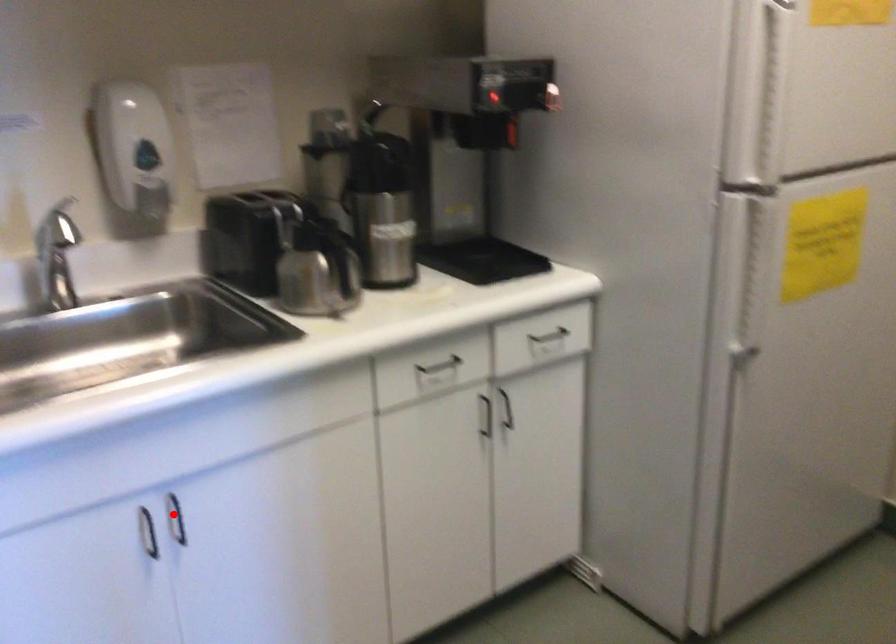
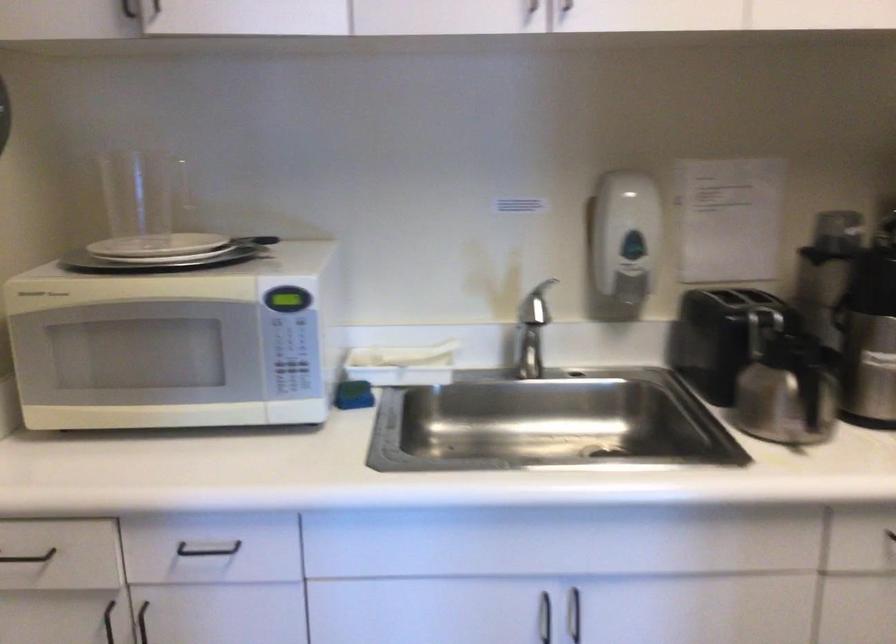
Where in the second image is the point corresponding to the highlighted location from the first image?

(573, 614)